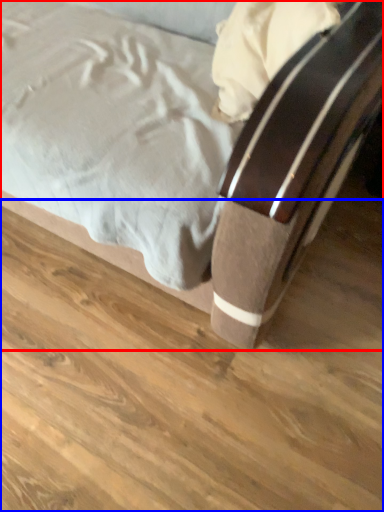
Question: Which object is further to the camera taking this photo, bed (highlighted by a red box) or plank (highlighted by a blue box)?

Choices:
 (A) bed
 (B) plank

Answer: (B)